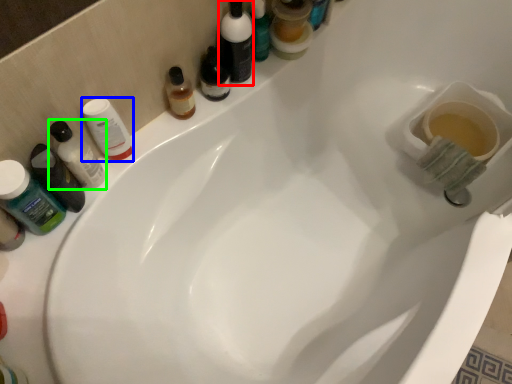
Question: Based on their relative distances, which object is farther from toiletry (highlighted by a red box)? Choose from mouthwash (highlighted by a blue box) and mouthwash (highlighted by a green box).

Choices:
 (A) mouthwash
 (B) mouthwash

Answer: (B)